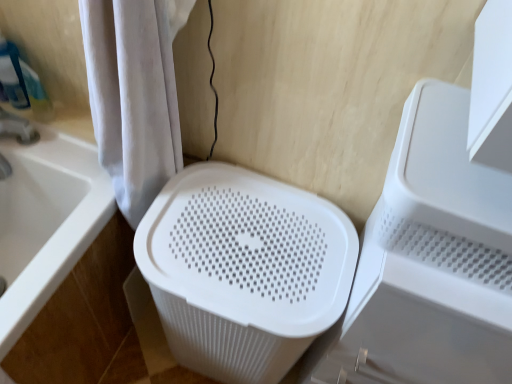
What is the approximate width of white plastic laundry basket at center?

white plastic laundry basket at center is 13.96 inches wide.

This screenshot has width=512, height=384. Describe the element at coordinates (134, 94) in the screenshot. I see `velvet white shower curtain at left` at that location.

This screenshot has height=384, width=512. What do you see at coordinates (429, 262) in the screenshot? I see `white plastic basket at center` at bounding box center [429, 262].

The width and height of the screenshot is (512, 384). Identify the location of white plastic bathtub at lower left. (46, 222).

Are white plastic basket at center and white plastic bathtub at lower left beside each other?

No, white plastic basket at center is not touching white plastic bathtub at lower left.

From a real-world perspective, is white plastic basket at center on top of white plastic bathtub at lower left?

Yes, from a real-world perspective, white plastic basket at center is over white plastic bathtub at lower left

How much distance is there between white plastic basket at center and white plastic bathtub at lower left?

white plastic basket at center and white plastic bathtub at lower left are 26.75 inches apart from each other.

From a real-world perspective, which object stands above the other?

white plastic basket at center is physically above.

Does white plastic basket at center touch white plastic laundry basket at center?

No, white plastic basket at center is not beside white plastic laundry basket at center.

Considering the positions of point (443, 99) and point (247, 209), is point (443, 99) closer or farther from the camera than point (247, 209)?

Clearly, point (443, 99) is closer to the camera than point (247, 209).

Is white plastic basket at center located outside white plastic laundry basket at center?

Yes.

From the image's perspective, between velvet white shower curtain at left and white plastic bathtub at lower left, which one is located above?

velvet white shower curtain at left.

Is velvet white shower curtain at left positioned far away from white plastic bathtub at lower left?

No.

Is velvet white shower curtain at left facing towards white plastic bathtub at lower left?

No, velvet white shower curtain at left is not facing towards white plastic bathtub at lower left.

From the picture: Does velvet white shower curtain at left come behind white plastic bathtub at lower left?

No.

Does white plastic laundry basket at center have a greater width compared to white plastic bathtub at lower left?

Incorrect, the width of white plastic laundry basket at center does not surpass that of white plastic bathtub at lower left.

Is white plastic laundry basket at center inside the boundaries of white plastic bathtub at lower left, or outside?

white plastic laundry basket at center is located beyond the bounds of white plastic bathtub at lower left.

Which point is more forward, (x=223, y=248) or (x=97, y=216)?

Point (x=223, y=248)

In the image, is white plastic laundry basket at center on the left side or the right side of white plastic bathtub at lower left?

Clearly, white plastic laundry basket at center is on the right of white plastic bathtub at lower left in the image.

From the image's perspective, is velvet white shower curtain at left under white plastic basket at center?

No, from the image's perspective, velvet white shower curtain at left is not beneath white plastic basket at center.

Can you confirm if velvet white shower curtain at left is thinner than white plastic basket at center?

Yes, velvet white shower curtain at left is thinner than white plastic basket at center.

Is velvet white shower curtain at left located outside white plastic basket at center?

Yes, velvet white shower curtain at left is outside of white plastic basket at center.

Is velvet white shower curtain at left oriented away from white plastic basket at center?

velvet white shower curtain at left is not turned away from white plastic basket at center.

Consider the image. Who is bigger, white plastic bathtub at lower left or white plastic laundry basket at center?

white plastic bathtub at lower left.

Considering the sizes of objects white plastic bathtub at lower left and white plastic laundry basket at center in the image provided, who is shorter, white plastic bathtub at lower left or white plastic laundry basket at center?

Standing shorter between the two is white plastic laundry basket at center.

Which object is further away from the camera taking this photo, white plastic bathtub at lower left or white plastic laundry basket at center?

white plastic laundry basket at center.

Which object is positioned more to the right, white plastic bathtub at lower left or white plastic laundry basket at center?

From the viewer's perspective, white plastic laundry basket at center appears more on the right side.

How different are the orientations of white plastic laundry basket at center and velvet white shower curtain at left in degrees?

There is a 1.9-degree angle between the facing directions of white plastic laundry basket at center and velvet white shower curtain at left.

Is point (296, 218) farther from camera compared to point (158, 87)?

Yes, point (296, 218) is farther from viewer.

Considering the sizes of objects white plastic laundry basket at center and velvet white shower curtain at left in the image provided, who is shorter, white plastic laundry basket at center or velvet white shower curtain at left?

Standing shorter between the two is velvet white shower curtain at left.

Where is `bathtub to the left of white plastic basket at center`? The height and width of the screenshot is (384, 512). bathtub to the left of white plastic basket at center is located at coordinates (46, 222).

You are a GUI agent. You are given a task and a screenshot of the screen. Output one action in this format:
    pyautogui.click(x=<x>, y=<y>)
    Task: Click on the laundry basket that appears below the white plastic basket at center (from a real-world perspective)
    This screenshot has width=512, height=384.
    Given the screenshot: What is the action you would take?
    pyautogui.click(x=244, y=270)

Based on their spatial positions, is white plastic bathtub at lower left or white plastic basket at center closer to velvet white shower curtain at left?

Based on the image, white plastic bathtub at lower left appears to be nearer to velvet white shower curtain at left.

Estimate the real-world distances between objects in this image. Which object is further from white plastic bathtub at lower left, white plastic basket at center or white plastic laundry basket at center?

Based on the image, white plastic basket at center appears to be further to white plastic bathtub at lower left.

From the image, which object appears to be farther from white plastic bathtub at lower left, velvet white shower curtain at left or white plastic basket at center?

white plastic basket at center is positioned further to the anchor white plastic bathtub at lower left.

Looking at the image, which one is located closer to velvet white shower curtain at left, white plastic laundry basket at center or white plastic bathtub at lower left?

Based on the image, white plastic bathtub at lower left appears to be nearer to velvet white shower curtain at left.

Consider the image. From the image, which object appears to be farther from white plastic laundry basket at center, white plastic basket at center or white plastic bathtub at lower left?

Based on the image, white plastic bathtub at lower left appears to be further to white plastic laundry basket at center.

Which object lies further to the anchor point velvet white shower curtain at left, white plastic laundry basket at center or white plastic basket at center?

The object further to velvet white shower curtain at left is white plastic basket at center.

Looking at the image, which one is located closer to white plastic laundry basket at center, white plastic basket at center or velvet white shower curtain at left?

The object closer to white plastic laundry basket at center is white plastic basket at center.

Consider the image. Which object lies further to the anchor point velvet white shower curtain at left, white plastic bathtub at lower left or white plastic laundry basket at center?

Among the two, white plastic laundry basket at center is located further to velvet white shower curtain at left.

Locate an element on the screen. laundry basket situated between white plastic bathtub at lower left and white plastic basket at center from left to right is located at coordinates (244, 270).

The image size is (512, 384). In order to click on laundry basket located between velvet white shower curtain at left and white plastic basket at center in the left-right direction in this screenshot , I will do `click(244, 270)`.

This screenshot has height=384, width=512. In order to click on shower curtain between white plastic bathtub at lower left and white plastic basket at center in this screenshot , I will do `click(134, 94)`.

Identify the location of shower curtain situated between white plastic bathtub at lower left and white plastic laundry basket at center from left to right. (134, 94).